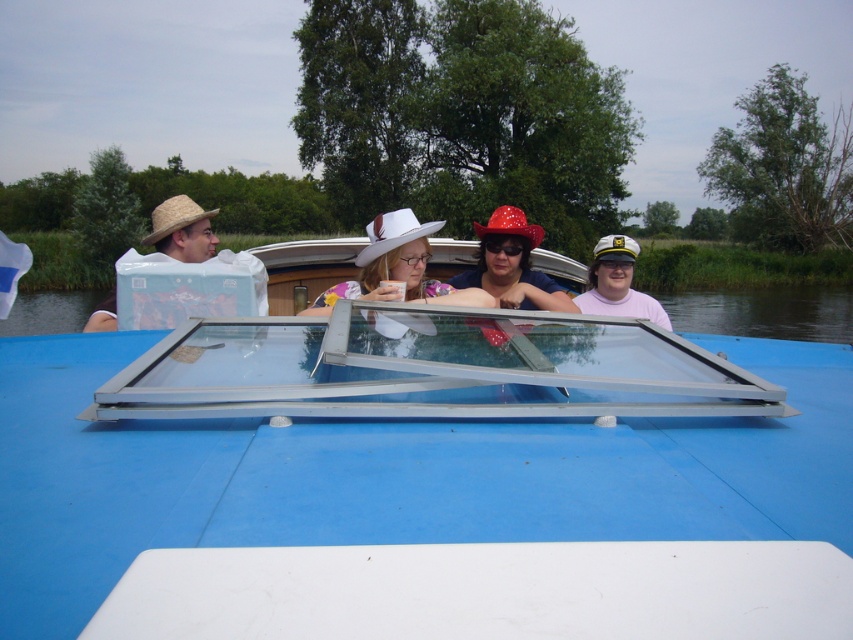
You are a photographer on the boat and want to take a photo of the pink matte cap at center and the matte straw hat at left. Which object is positioned lower in the frame?

The pink matte cap at center is located below the matte straw hat at left, so it is positioned lower in the frame.

You are a photographer taking pictures of the people on the boat. You notice the pink matte cap at center and the matte straw hat at left. Which hat appears shorter in the photo?

The pink matte cap at center appears shorter than the matte straw hat at left in the photo.

You are planning to stand up inside the transparent glass boat at center. Considering the height of the boat and the matte straw hat at left, do you think you can stand up without hitting your head?

The transparent glass boat at center is not as tall as the matte straw hat at left. Since the boat is shorter than the hat, standing up might cause your head to hit the transparent roof. You should check the height before standing.